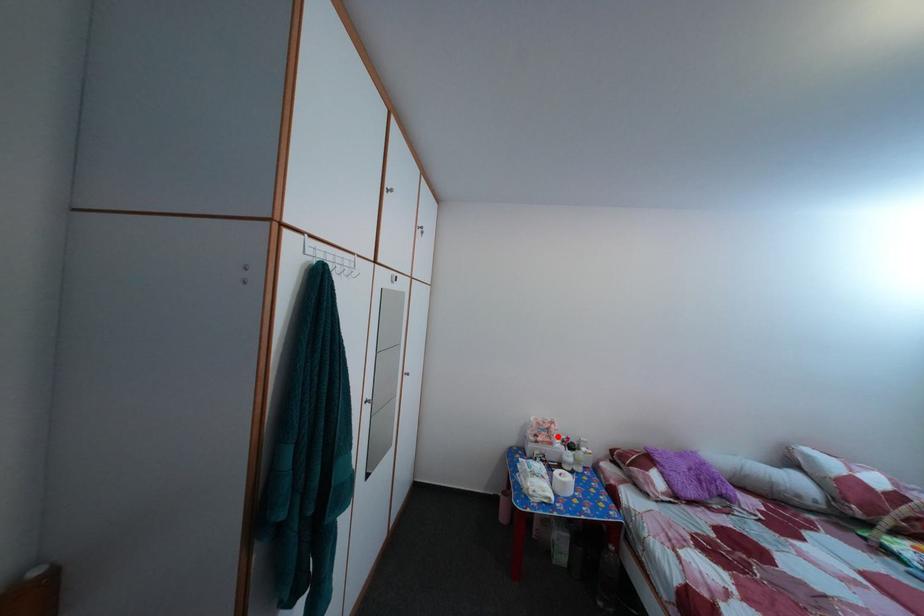
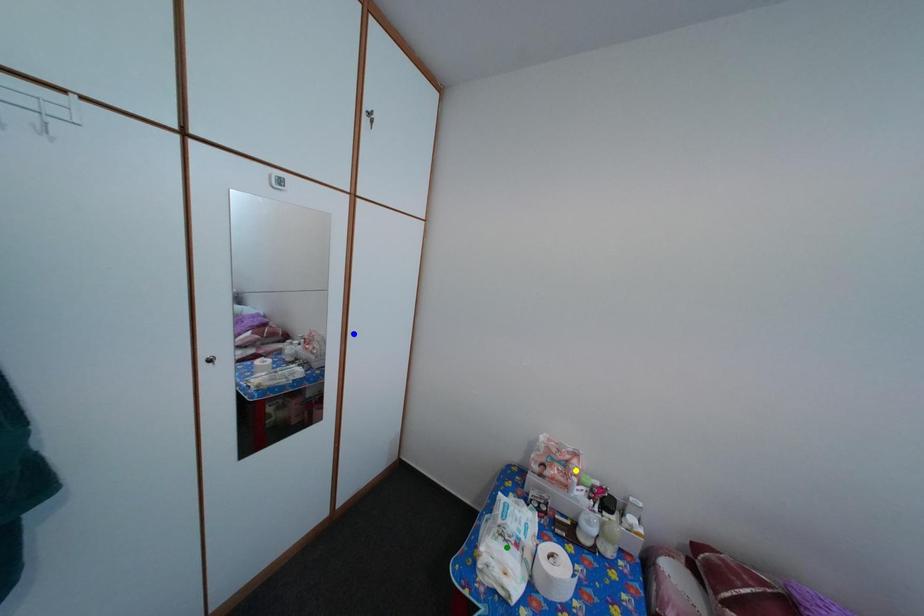
Question: I am providing you with two images of the same scene from different viewpoints. A red point is marked on the first image. You are given multiple points on the second image. In image 2, which mark is for the same physical point as the one in image 1?

Choices:
 (A) yellow point
 (B) blue point
 (C) green point

Answer: (A)